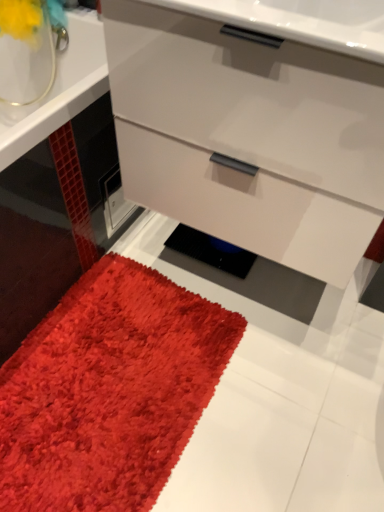
This screenshot has width=384, height=512. What are the coordinates of `vacant location below matte white chest of drawers at center (from a real-world perspective)` in the screenshot? It's located at (246, 287).